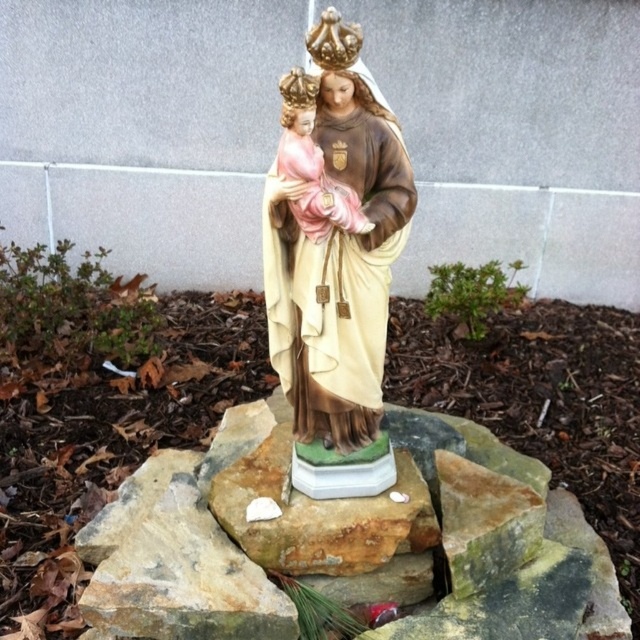
Which is in front, point (435, 545) or point (353, 214)?

Point (353, 214) is in front.

This screenshot has height=640, width=640. I want to click on green stone at center, so click(x=320, y=515).

What do you see at coordinates (333, 259) in the screenshot? The height and width of the screenshot is (640, 640). I see `matte porcelain statue at center` at bounding box center [333, 259].

Is matte porcelain statue at center to the right of green stone at center from the viewer's perspective?

Indeed, matte porcelain statue at center is positioned on the right side of green stone at center.

Where is `matte porcelain statue at center`? matte porcelain statue at center is located at coordinates (333, 259).

Is matte porcelain statue at center further to the viewer compared to matte porcelain doll at center?

Yes.

Can you confirm if matte porcelain statue at center is positioned above matte porcelain doll at center?

No, matte porcelain statue at center is not above matte porcelain doll at center.

Describe the element at coordinates (333, 259) in the screenshot. I see `matte porcelain statue at center` at that location.

This screenshot has height=640, width=640. I want to click on matte porcelain statue at center, so click(x=333, y=259).